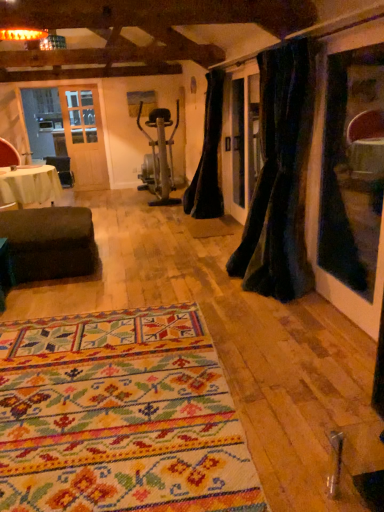
Question: Can you confirm if multicolored woven rug at center is taller than white fabric-covered table at left?

Choices:
 (A) yes
 (B) no

Answer: (B)

Question: Is multicolored woven rug at center in contact with white fabric-covered table at left?

Choices:
 (A) no
 (B) yes

Answer: (A)

Question: Is multicolored woven rug at center thinner than white fabric-covered table at left?

Choices:
 (A) no
 (B) yes

Answer: (A)

Question: Would you say white fabric-covered table at left is part of multicolored woven rug at center's contents?

Choices:
 (A) no
 (B) yes

Answer: (A)

Question: Is multicolored woven rug at center shorter than white fabric-covered table at left?

Choices:
 (A) no
 (B) yes

Answer: (B)

Question: Considering the positions of velvet dark green curtain at right, the second curtain positioned from the left, and black velvet curtain at center, the first curtain positioned from the left, in the image, is velvet dark green curtain at right, the second curtain positioned from the left, taller or shorter than black velvet curtain at center, the first curtain positioned from the left,?

Choices:
 (A) tall
 (B) short

Answer: (A)

Question: Which is correct: velvet dark green curtain at right, which appears as the 1th curtain when viewed from the right, is inside black velvet curtain at center, acting as the 2th curtain starting from the right, or outside of it?

Choices:
 (A) outside
 (B) inside

Answer: (A)

Question: Is point (251, 278) positioned closer to the camera than point (208, 151)?

Choices:
 (A) farther
 (B) closer

Answer: (B)

Question: From the image's perspective, relative to black velvet curtain at center, the first curtain positioned from the left, is velvet dark green curtain at right, arranged as the first curtain when viewed from the front, above or below?

Choices:
 (A) above
 (B) below

Answer: (B)

Question: Is multicolored woven rug at center bigger or smaller than white fabric-covered table at left?

Choices:
 (A) big
 (B) small

Answer: (B)

Question: Is multicolored woven rug at center to the left or to the right of white fabric-covered table at left in the image?

Choices:
 (A) right
 (B) left

Answer: (A)

Question: From their relative heights in the image, would you say multicolored woven rug at center is taller or shorter than white fabric-covered table at left?

Choices:
 (A) tall
 (B) short

Answer: (B)

Question: Would you say multicolored woven rug at center is inside or outside white fabric-covered table at left?

Choices:
 (A) outside
 (B) inside

Answer: (A)

Question: Looking at the image, does multicolored woven rug at center seem bigger or smaller compared to velvet dark green curtain at right, the second curtain positioned from the left?

Choices:
 (A) big
 (B) small

Answer: (B)

Question: From a real-world perspective, is multicolored woven rug at center above or below velvet dark green curtain at right, the second curtain positioned from the left?

Choices:
 (A) below
 (B) above

Answer: (A)